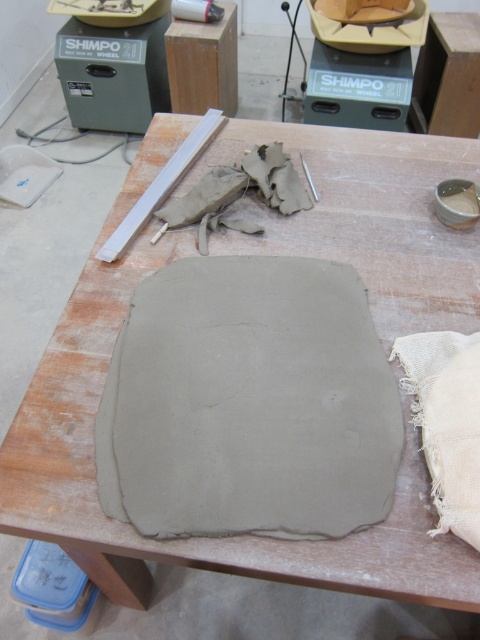
Which is in front, point (249, 433) or point (428, 465)?

Positioned in front is point (428, 465).

Between gray clay pad at center and white burlap cloth at lower right, which one is positioned lower?

Positioned lower is white burlap cloth at lower right.

Is point (186, 440) behind point (417, 392)?

No, (186, 440) is closer to viewer.

At what (x,y) coordinates should I click in order to perform the action: click on gray clay pad at center. Please return your answer as a coordinate pair (x, y). The width and height of the screenshot is (480, 640). Looking at the image, I should click on (249, 403).